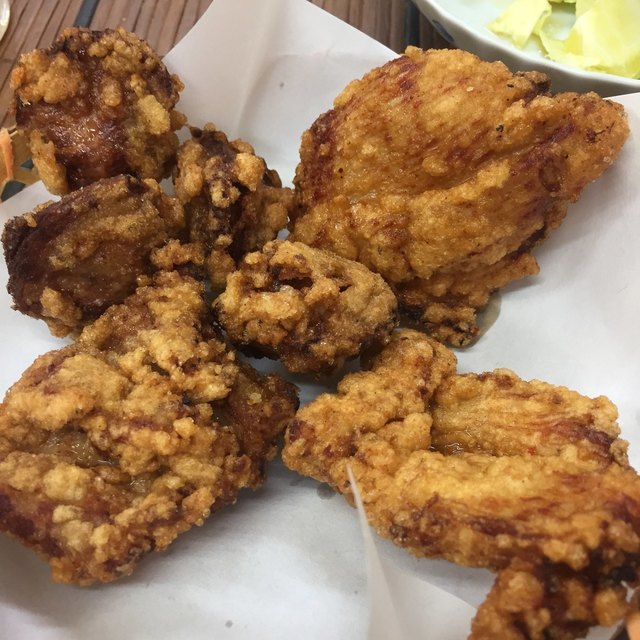
Where is `bowl`? bowl is located at coordinates (470, 24).